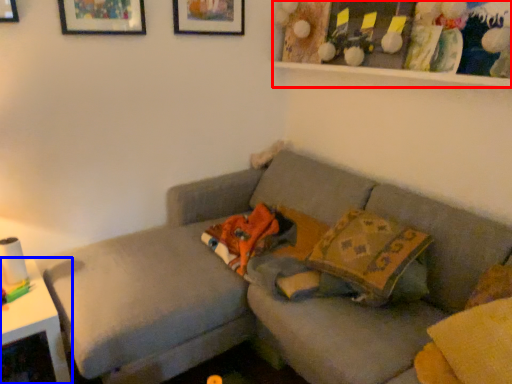
Question: Among these objects, which one is farthest to the camera, shelf (highlighted by a red box) or table (highlighted by a blue box)?

Choices:
 (A) shelf
 (B) table

Answer: (B)